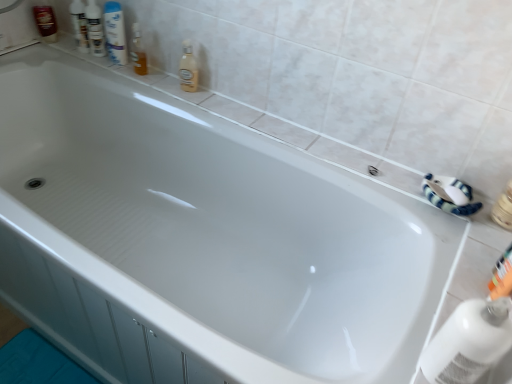
Question: Is transparent plastic bottle at lower right, which appears as the 1th cleaning product when viewed from the front, turned away from white glossy mouthwash at upper left?

Choices:
 (A) no
 (B) yes

Answer: (A)

Question: Considering the relative sizes of transparent plastic bottle at lower right, which appears as the 2th cleaning product when viewed from the top, and white glossy mouthwash at upper left in the image provided, is transparent plastic bottle at lower right, which appears as the 2th cleaning product when viewed from the top, smaller than white glossy mouthwash at upper left?

Choices:
 (A) yes
 (B) no

Answer: (B)

Question: From a real-world perspective, is transparent plastic bottle at lower right, marked as the first cleaning product in a bottom-to-top arrangement, under white glossy mouthwash at upper left?

Choices:
 (A) yes
 (B) no

Answer: (A)

Question: Does transparent plastic bottle at lower right, placed as the 1th cleaning product when sorted from right to left, have a lesser height compared to white glossy mouthwash at upper left?

Choices:
 (A) yes
 (B) no

Answer: (A)

Question: Considering the relative positions of transparent plastic bottle at lower right, which appears as the 1th cleaning product when viewed from the front, and white glossy mouthwash at upper left in the image provided, is transparent plastic bottle at lower right, which appears as the 1th cleaning product when viewed from the front, in front of white glossy mouthwash at upper left?

Choices:
 (A) no
 (B) yes

Answer: (B)

Question: Does transparent plastic bottle at lower right, marked as the first cleaning product in a bottom-to-top arrangement, have a larger size compared to white glossy mouthwash at upper left?

Choices:
 (A) yes
 (B) no

Answer: (A)

Question: Would you say white glossy shampoo bottles at upper left, the 4th toiletry positioned from the bottom, is outside orange plastic toothbrush at lower right, the fifth toiletry from the left?

Choices:
 (A) no
 (B) yes

Answer: (B)

Question: Is white glossy shampoo bottles at upper left, positioned as the second toiletry in back-to-front order, far from orange plastic toothbrush at lower right, the fifth toiletry from the left?

Choices:
 (A) yes
 (B) no

Answer: (A)

Question: Is the position of white glossy shampoo bottles at upper left, which appears as the 4th toiletry when viewed from the front, less distant than that of orange plastic toothbrush at lower right, the fifth toiletry from the left?

Choices:
 (A) yes
 (B) no

Answer: (B)

Question: Considering the relative sizes of white glossy shampoo bottles at upper left, positioned as the second toiletry in left-to-right order, and orange plastic toothbrush at lower right, the 1th toiletry in the bottom-to-top sequence, in the image provided, is white glossy shampoo bottles at upper left, positioned as the second toiletry in left-to-right order, thinner than orange plastic toothbrush at lower right, the 1th toiletry in the bottom-to-top sequence,?

Choices:
 (A) yes
 (B) no

Answer: (B)

Question: Is orange plastic toothbrush at lower right, the 5th toiletry when ordered from back to front, inside white glossy shampoo bottles at upper left, positioned as the second toiletry in back-to-front order?

Choices:
 (A) no
 (B) yes

Answer: (A)

Question: Is white glossy shampoo bottles at upper left, positioned as the second toiletry in left-to-right order, further to the viewer compared to orange plastic toothbrush at lower right, the 5th toiletry when ordered from back to front?

Choices:
 (A) no
 (B) yes

Answer: (B)

Question: Is white glossy mouthwash at upper left located outside shiny brown bottle at upper left, the fifth toiletry viewed from the front?

Choices:
 (A) yes
 (B) no

Answer: (A)